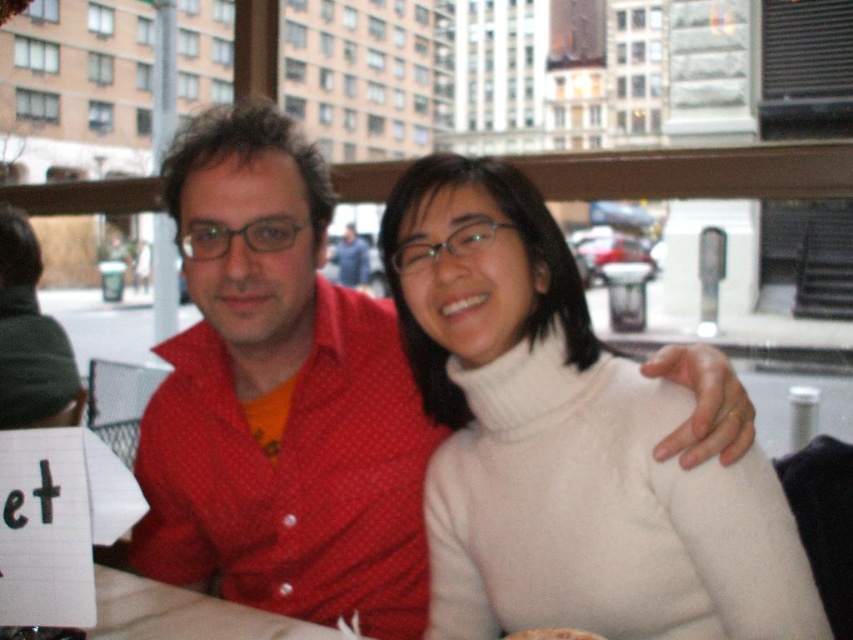
Is white wool sweater at center above red dotted shirt at center?

Actually, white wool sweater at center is below red dotted shirt at center.

The width and height of the screenshot is (853, 640). In order to click on white wool sweater at center in this screenshot , I will do `click(566, 444)`.

Where is `white wool sweater at center`? white wool sweater at center is located at coordinates (566, 444).

Where is `red dotted shirt at center`? The width and height of the screenshot is (853, 640). red dotted shirt at center is located at coordinates (279, 397).

Does red dotted shirt at center have a greater width compared to brown crumbly bread at center?

Yes, red dotted shirt at center is wider than brown crumbly bread at center.

The width and height of the screenshot is (853, 640). What do you see at coordinates (279, 397) in the screenshot?
I see `red dotted shirt at center` at bounding box center [279, 397].

Locate an element on the screen. The height and width of the screenshot is (640, 853). red dotted shirt at center is located at coordinates point(279,397).

Does white wool sweater at center appear under brown crumbly bread at center?

No, white wool sweater at center is not below brown crumbly bread at center.

Describe the element at coordinates (566, 444) in the screenshot. I see `white wool sweater at center` at that location.

You are a GUI agent. You are given a task and a screenshot of the screen. Output one action in this format:
    pyautogui.click(x=<x>, y=<y>)
    Task: Click on the white wool sweater at center
    This screenshot has height=640, width=853.
    Given the screenshot: What is the action you would take?
    pyautogui.click(x=566, y=444)